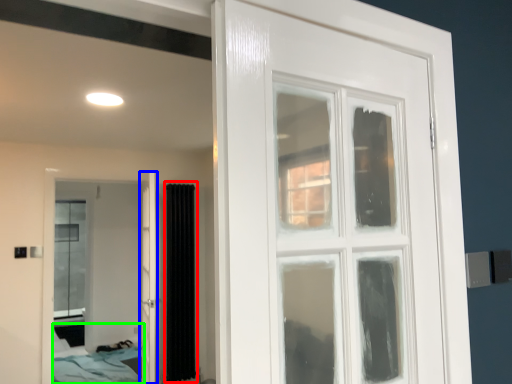
Question: Based on their relative distances, which object is farther from curtain (highlighted by a red box)? Choose from door (highlighted by a blue box) and bed (highlighted by a green box).

Choices:
 (A) door
 (B) bed

Answer: (B)